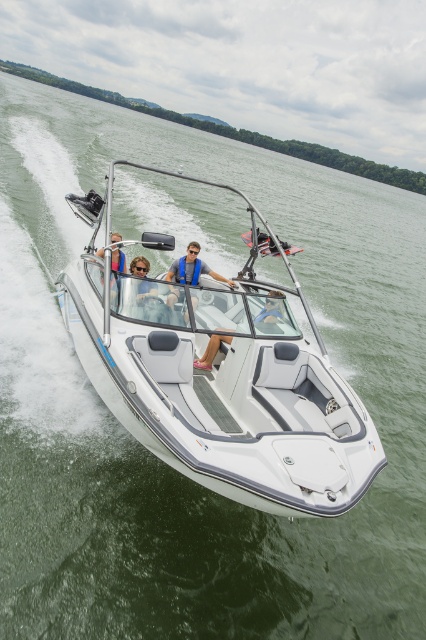
Question: Among these objects, which one is farthest from the camera?

Choices:
 (A) matte black life vest at center
 (B) white matte boat at center
 (C) matte gray seat at center

Answer: (C)

Question: Which point is farther to the camera?

Choices:
 (A) (112, 240)
 (B) (184, 273)
 (C) (270, 321)

Answer: (B)

Question: Estimate the real-world distances between objects in this image. Which object is farther from the matte black life vest at center?

Choices:
 (A) white matte boat at center
 (B) matte black sunglasses at center
 (C) matte gray seat at center

Answer: (A)

Question: Does white matte boat at center appear on the right side of matte blue life vest at center?

Choices:
 (A) no
 (B) yes

Answer: (B)

Question: Is matte blue life vest at center closer to the viewer compared to matte black life vest at center?

Choices:
 (A) yes
 (B) no

Answer: (B)

Question: Does matte black sunglasses at center have a greater width compared to matte blue life vest at center?

Choices:
 (A) no
 (B) yes

Answer: (A)